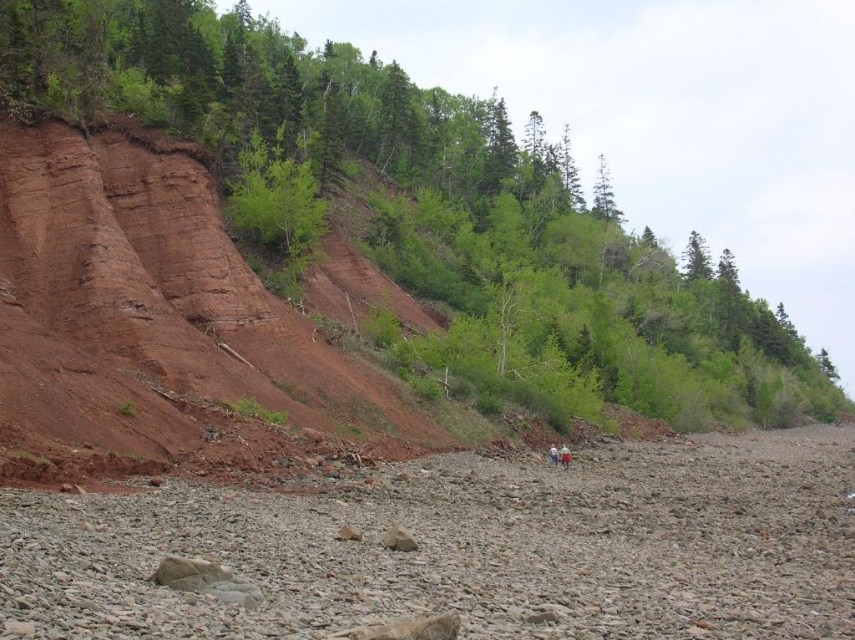
Is light blue denim jeans at lower center bigger than light blue denim jeans at center?

Indeed, light blue denim jeans at lower center has a larger size compared to light blue denim jeans at center.

What do you see at coordinates (564, 456) in the screenshot? The image size is (855, 640). I see `light blue denim jeans at lower center` at bounding box center [564, 456].

Is point (567, 449) positioned before point (555, 461)?

That is False.

Where is `light blue denim jeans at lower center`? light blue denim jeans at lower center is located at coordinates (564, 456).

Is green leafy tree at upper center to the left of gray gravelly shore at lower center from the viewer's perspective?

In fact, green leafy tree at upper center is to the right of gray gravelly shore at lower center.

Does green leafy tree at upper center appear over gray gravelly shore at lower center?

Correct, green leafy tree at upper center is located above gray gravelly shore at lower center.

Is point (481, 300) less distant than point (449, 499)?

That is False.

Find the location of a particular element. Image resolution: width=855 pixels, height=640 pixels. green leafy tree at upper center is located at coordinates (422, 200).

Based on the photo, is gray gravelly shore at lower center shorter than light blue denim jeans at lower center?

No, gray gravelly shore at lower center is not shorter than light blue denim jeans at lower center.

Between gray gravelly shore at lower center and light blue denim jeans at lower center, which one appears on the right side from the viewer's perspective?

From the viewer's perspective, gray gravelly shore at lower center appears more on the right side.

What do you see at coordinates (469, 548) in the screenshot? This screenshot has width=855, height=640. I see `gray gravelly shore at lower center` at bounding box center [469, 548].

Locate an element on the screen. gray gravelly shore at lower center is located at coordinates (469, 548).